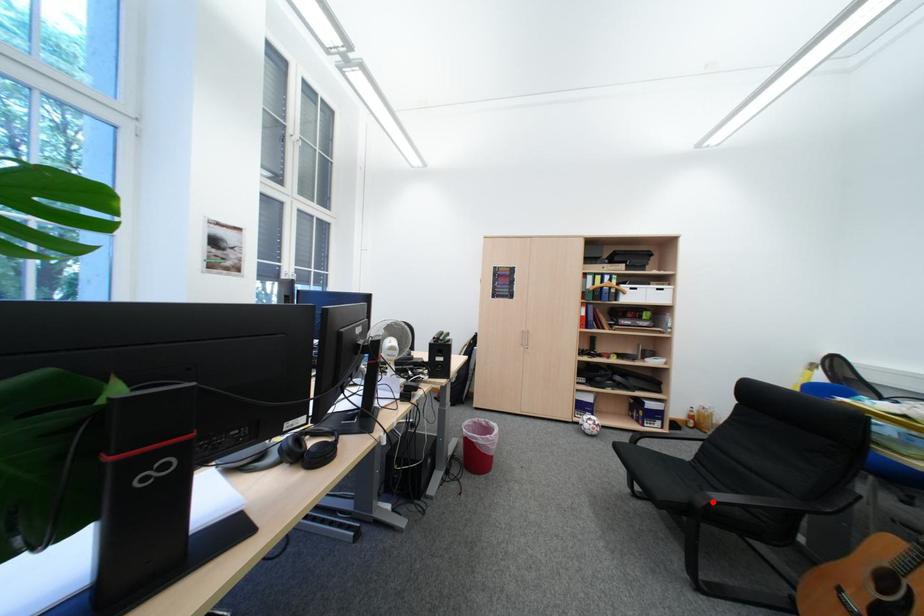
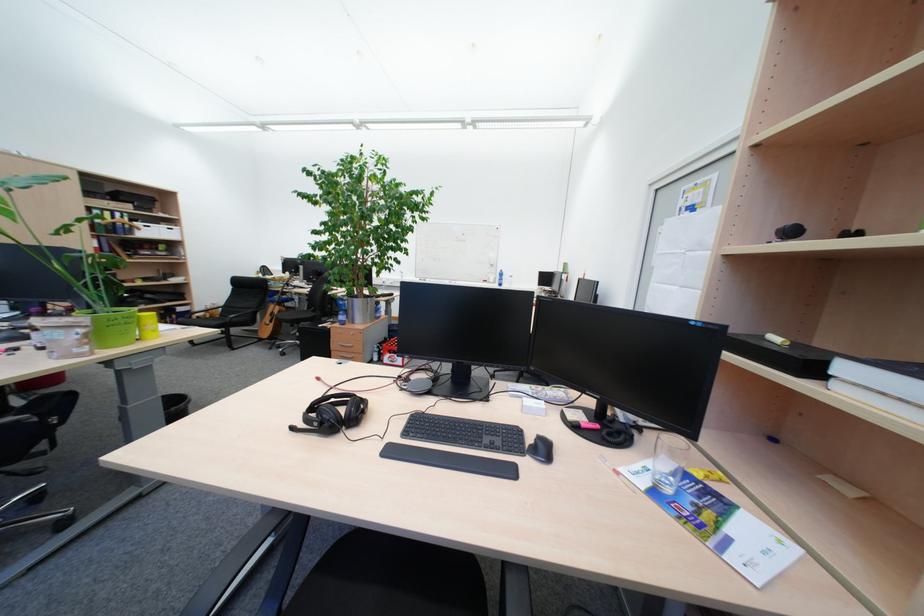
The point at the highlighted location is marked in the first image. Where is the corresponding point in the second image?

(239, 321)